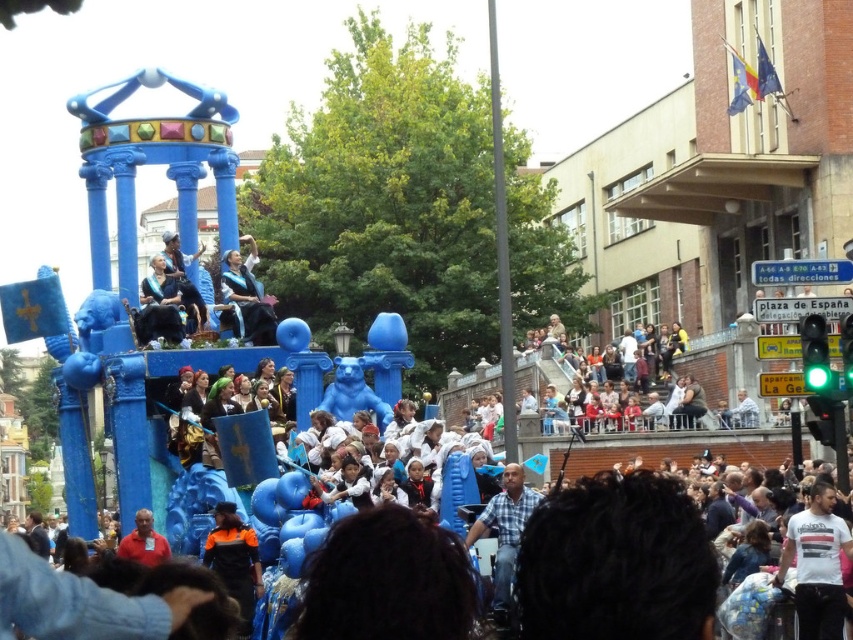
Is matte black outfit at center further to the viewer compared to matte orange shirt at lower left?

Yes, matte black outfit at center is behind matte orange shirt at lower left.

Is matte black outfit at center thinner than matte orange shirt at lower left?

Yes.

The image size is (853, 640). Describe the element at coordinates (184, 282) in the screenshot. I see `matte black outfit at center` at that location.

I want to click on matte black outfit at center, so click(x=184, y=282).

Can you confirm if plaid shirt at center is smaller than matte black outfit at center?

Actually, plaid shirt at center might be larger than matte black outfit at center.

Between plaid shirt at center and matte black outfit at center, which one appears on the left side from the viewer's perspective?

matte black outfit at center is more to the left.

At what (x,y) coordinates should I click in order to perform the action: click on plaid shirt at center. Please return your answer as a coordinate pair (x, y). This screenshot has height=640, width=853. Looking at the image, I should click on (505, 531).

Based on the photo, measure the distance between point (788, 564) and camera.

Point (788, 564) and camera are 71.45 meters apart from each other.

Who is shorter, white cotton t-shirt at lower right or graduation gown at center?

With less height is white cotton t-shirt at lower right.

Does point (828, 593) come farther from viewer compared to point (247, 340)?

No, (828, 593) is closer to viewer.

Where is `white cotton t-shirt at lower right`? This screenshot has width=853, height=640. white cotton t-shirt at lower right is located at coordinates (816, 564).